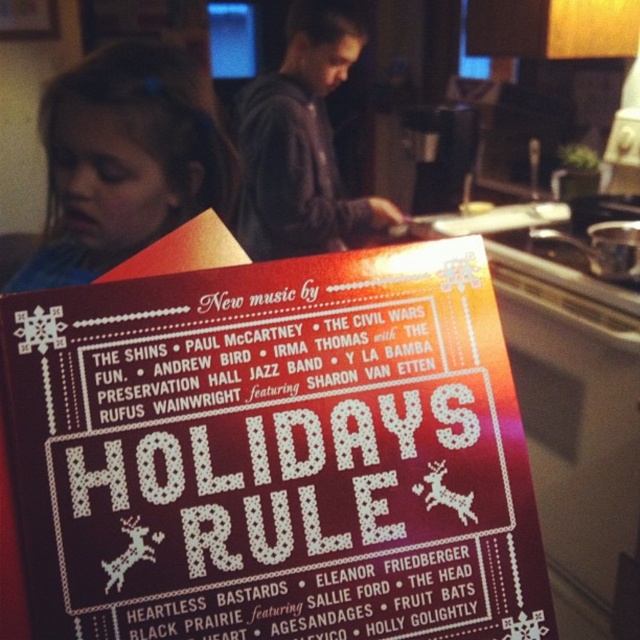
Question: Which object is closer to the camera taking this photo?

Choices:
 (A) dark gray hoodie at center
 (B) matte blue hair at upper left
 (C) matte paper poster at center

Answer: (C)

Question: Estimate the real-world distances between objects in this image. Which object is farther from the matte paper poster at center?

Choices:
 (A) metallic silver pot at upper right
 (B) matte blue hair at upper left

Answer: (A)

Question: Is dark gray hoodie at center below metallic silver pot at upper right?

Choices:
 (A) yes
 (B) no

Answer: (B)

Question: Observing the image, what is the correct spatial positioning of matte blue hair at upper left in reference to metallic silver pot at upper right?

Choices:
 (A) above
 (B) below

Answer: (A)

Question: Considering the relative positions of matte paper poster at center and matte blue hair at upper left in the image provided, where is matte paper poster at center located with respect to matte blue hair at upper left?

Choices:
 (A) left
 (B) right

Answer: (B)

Question: Which point is closer to the camera?

Choices:
 (A) metallic silver pot at upper right
 (B) matte blue hair at upper left
 (C) matte paper poster at center
 (D) dark gray hoodie at center

Answer: (C)